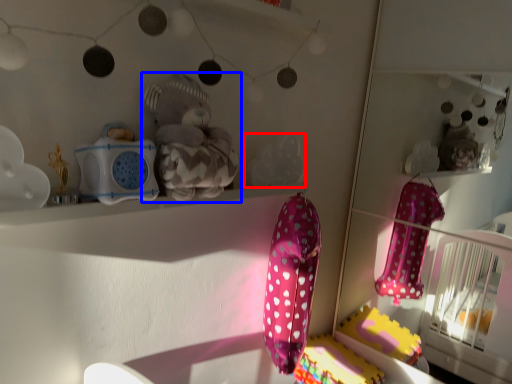
Question: Among these objects, which one is farthest to the camera, toy (highlighted by a red box) or toy (highlighted by a blue box)?

Choices:
 (A) toy
 (B) toy

Answer: (A)